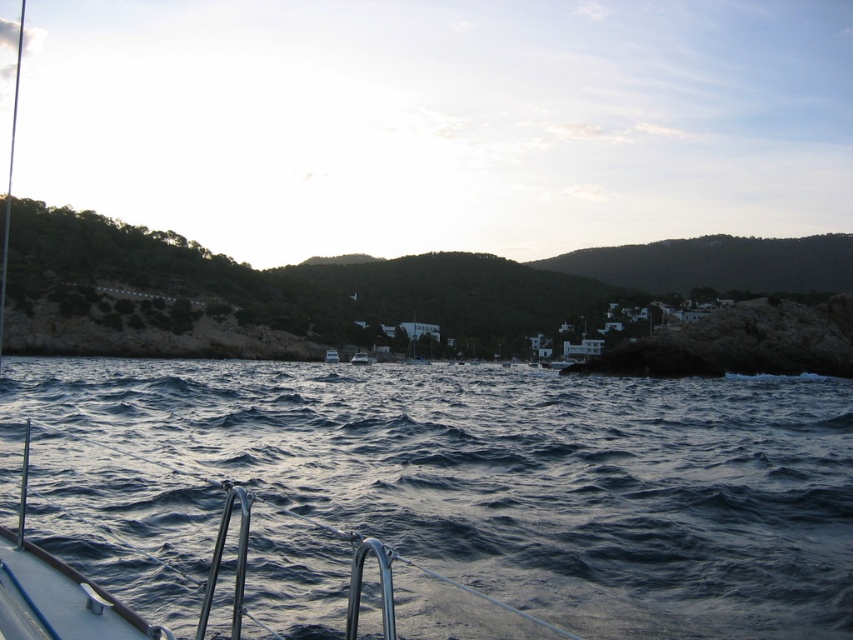
You are standing on the deck of the boat and want to take a photo of both the green grassy hill at upper center and the white glossy boat at center. Which object should you focus on first to ensure both are in clear view?

You should focus on the green grassy hill at upper center first because it is closer to you than the white glossy boat at center, ensuring both are in focus when using depth of field.

You are a photographer on a boat and want to capture a photo that emphasizes the green grassy hill at upper center while still including the white glossy boat at center. Given their sizes, which object should you focus on to ensure the hill takes up more of the frame?

The green grassy hill at upper center is larger in size compared to the white glossy boat at center, so focusing on the hill will naturally make it occupy more of the frame while still including the boat in the shot.

You are standing on the deck of the sailing boat and looking at two points marked in the scene. The first point is at coordinates point (x=161, y=355) and the second is at point (x=334, y=353). Which point is nearer to you?

Point (x=161, y=355) is closer to the viewer than point (x=334, y=353).